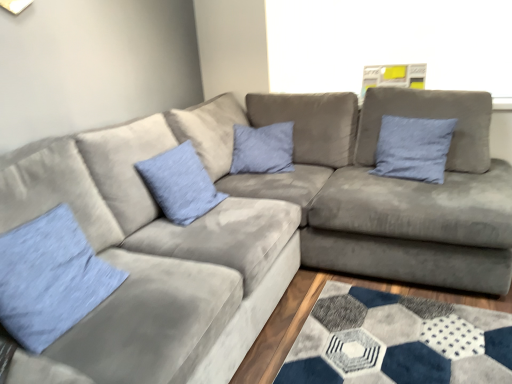
Measure the distance between point (186, 194) and camera.

A distance of 2.04 meters exists between point (186, 194) and camera.

At what (x,y) coordinates should I click in order to perform the action: click on light blue fabric pillow at lower left, the first pillow from the front. Please return your answer as a coordinate pair (x, y). This screenshot has height=384, width=512. Looking at the image, I should click on (50, 278).

This screenshot has width=512, height=384. In order to click on blue fabric pillow at center, which is counted as the 2th pillow, starting from the back in this screenshot , I will do `click(180, 184)`.

Is blue fabric pillow at upper right, which is counted as the 3th pillow, starting from the front, surrounding blue fabric pillow at center, the second pillow positioned from the front?

No, blue fabric pillow at upper right, which is counted as the 3th pillow, starting from the front, does not contain blue fabric pillow at center, the second pillow positioned from the front.

Which object is thinner, blue fabric pillow at upper right, which is counted as the 3th pillow, starting from the front, or blue fabric pillow at center, the second pillow positioned from the front?

blue fabric pillow at upper right, which is counted as the 3th pillow, starting from the front, is thinner.

Is blue fabric pillow at upper right, which is the third pillow in left-to-right order, behind blue fabric pillow at center, which is counted as the 2th pillow, starting from the back?

Yes, blue fabric pillow at upper right, which is the third pillow in left-to-right order, is behind blue fabric pillow at center, which is counted as the 2th pillow, starting from the back.

Looking at this image, is blue fabric pillow at center, which is counted as the 2th pillow, starting from the back, in front of blue fabric pillow at upper right, the first pillow in the right-to-left sequence?

Yes, the depth of blue fabric pillow at center, which is counted as the 2th pillow, starting from the back, is less than that of blue fabric pillow at upper right, the first pillow in the right-to-left sequence.

Considering the positions of point (168, 161) and point (440, 134), is point (168, 161) closer or farther from the camera than point (440, 134)?

Point (168, 161) appears to be closer to the viewer than point (440, 134).

From a real-world perspective, is blue fabric pillow at center, which appears as the second pillow when viewed from the right, over blue fabric pillow at upper right, which is the third pillow in left-to-right order?

Actually, blue fabric pillow at center, which appears as the second pillow when viewed from the right, is physically below blue fabric pillow at upper right, which is the third pillow in left-to-right order, in the real world.

Can we say light blue fabric pillow at lower left, which is counted as the third pillow, starting from the back, lies outside blue fabric pillow at center, the second pillow positioned from the front?

Yes, light blue fabric pillow at lower left, which is counted as the third pillow, starting from the back, is outside of blue fabric pillow at center, the second pillow positioned from the front.

From a real-world perspective, is light blue fabric pillow at lower left, the 1th pillow viewed from the left, below blue fabric pillow at center, acting as the second pillow starting from the left?

Yes, from a real-world perspective, light blue fabric pillow at lower left, the 1th pillow viewed from the left, is beneath blue fabric pillow at center, acting as the second pillow starting from the left.

Considering the relative sizes of light blue fabric pillow at lower left, the 1th pillow viewed from the left, and blue fabric pillow at center, acting as the second pillow starting from the left, in the image provided, is light blue fabric pillow at lower left, the 1th pillow viewed from the left, thinner than blue fabric pillow at center, acting as the second pillow starting from the left,?

Incorrect, the width of light blue fabric pillow at lower left, the 1th pillow viewed from the left, is not less than that of blue fabric pillow at center, acting as the second pillow starting from the left.

The image size is (512, 384). In order to click on pillow below the blue fabric pillow at center, which is counted as the 2th pillow, starting from the back (from a real-world perspective) in this screenshot , I will do `click(50, 278)`.

Is blue fabric pillow at center, the second pillow positioned from the front, further to the viewer compared to light blue fabric pillow at lower left, which is counted as the third pillow, starting from the back?

Yes.

Does blue fabric pillow at center, which is counted as the 2th pillow, starting from the back, turn towards light blue fabric pillow at lower left, which is counted as the third pillow, starting from the back?

No, blue fabric pillow at center, which is counted as the 2th pillow, starting from the back, is not aimed at light blue fabric pillow at lower left, which is counted as the third pillow, starting from the back.

Can you confirm if blue fabric pillow at center, which is counted as the 2th pillow, starting from the back, is taller than light blue fabric pillow at lower left, the first pillow from the front?

Correct, blue fabric pillow at center, which is counted as the 2th pillow, starting from the back, is much taller as light blue fabric pillow at lower left, the first pillow from the front.

Is blue fabric pillow at upper right, the first pillow in the right-to-left sequence, in front of or behind light blue fabric pillow at lower left, which is counted as the third pillow, starting from the back, in the image?

Clearly, blue fabric pillow at upper right, the first pillow in the right-to-left sequence, is behind light blue fabric pillow at lower left, which is counted as the third pillow, starting from the back.

Considering the relative positions of blue fabric pillow at upper right, which is the third pillow in left-to-right order, and light blue fabric pillow at lower left, which is counted as the third pillow, starting from the back, in the image provided, is blue fabric pillow at upper right, which is the third pillow in left-to-right order, to the right of light blue fabric pillow at lower left, which is counted as the third pillow, starting from the back, from the viewer's perspective?

Yes.

Can you see blue fabric pillow at upper right, which is the third pillow in left-to-right order, touching light blue fabric pillow at lower left, the first pillow from the front?

Result: No, blue fabric pillow at upper right, which is the third pillow in left-to-right order, is not with light blue fabric pillow at lower left, the first pillow from the front.

Between light blue fabric pillow at lower left, the first pillow from the front, and blue fabric pillow at upper right, the first pillow in the right-to-left sequence, which one has smaller width?

blue fabric pillow at upper right, the first pillow in the right-to-left sequence.

Is light blue fabric pillow at lower left, the first pillow from the front, directly adjacent to blue fabric pillow at upper right, the first pillow in the back-to-front sequence?

There is a gap between light blue fabric pillow at lower left, the first pillow from the front, and blue fabric pillow at upper right, the first pillow in the back-to-front sequence.

From the image's perspective, is light blue fabric pillow at lower left, which is counted as the 3th pillow, starting from the right, over blue fabric pillow at upper right, the first pillow in the back-to-front sequence?

Actually, light blue fabric pillow at lower left, which is counted as the 3th pillow, starting from the right, appears below blue fabric pillow at upper right, the first pillow in the back-to-front sequence, in the image.

What are the coordinates of `pillow that is behind the blue fabric pillow at center, the second pillow positioned from the front` in the screenshot? It's located at (413, 148).

This screenshot has width=512, height=384. Identify the location of pillow on the right of the blue fabric pillow at center, which is counted as the 2th pillow, starting from the back. (413, 148).

Looking at the image, which one is located closer to blue fabric pillow at center, acting as the second pillow starting from the left, blue fabric pillow at upper right, which is the third pillow in left-to-right order, or light blue fabric pillow at lower left, the first pillow from the front?

Among the two, light blue fabric pillow at lower left, the first pillow from the front, is located nearer to blue fabric pillow at center, acting as the second pillow starting from the left.

Consider the image. Based on their spatial positions, is light blue fabric pillow at lower left, the first pillow from the front, or blue fabric pillow at center, which appears as the second pillow when viewed from the right, further from blue fabric pillow at upper right, which is counted as the 3th pillow, starting from the front?

light blue fabric pillow at lower left, the first pillow from the front, is positioned further to the anchor blue fabric pillow at upper right, which is counted as the 3th pillow, starting from the front.

Which object lies further to the anchor point light blue fabric pillow at lower left, the 1th pillow viewed from the left, blue fabric pillow at center, which is counted as the 2th pillow, starting from the back, or blue fabric pillow at upper right, which is counted as the 3th pillow, starting from the front?

blue fabric pillow at upper right, which is counted as the 3th pillow, starting from the front, lies further to light blue fabric pillow at lower left, the 1th pillow viewed from the left, than the other object.

Looking at the image, which one is located further to blue fabric pillow at center, the second pillow positioned from the front, light blue fabric pillow at lower left, the 1th pillow viewed from the left, or blue fabric pillow at upper right, the first pillow in the right-to-left sequence?

Among the two, blue fabric pillow at upper right, the first pillow in the right-to-left sequence, is located further to blue fabric pillow at center, the second pillow positioned from the front.

From the image, which object appears to be nearer to blue fabric pillow at upper right, the first pillow in the back-to-front sequence, blue fabric pillow at center, which is counted as the 2th pillow, starting from the back, or light blue fabric pillow at lower left, which is counted as the 3th pillow, starting from the right?

blue fabric pillow at center, which is counted as the 2th pillow, starting from the back, is closer to blue fabric pillow at upper right, the first pillow in the back-to-front sequence.

Considering their positions, is blue fabric pillow at upper right, which is the third pillow in left-to-right order, positioned closer to light blue fabric pillow at lower left, the 1th pillow viewed from the left, than blue fabric pillow at center, which appears as the second pillow when viewed from the right?

The object closer to light blue fabric pillow at lower left, the 1th pillow viewed from the left, is blue fabric pillow at center, which appears as the second pillow when viewed from the right.

You are a GUI agent. You are given a task and a screenshot of the screen. Output one action in this format:
    pyautogui.click(x=<x>, y=<y>)
    Task: Click on the pillow situated between light blue fabric pillow at lower left, which is counted as the third pillow, starting from the back, and blue fabric pillow at upper right, the first pillow in the back-to-front sequence, from left to right
    The height and width of the screenshot is (384, 512).
    Given the screenshot: What is the action you would take?
    pyautogui.click(x=180, y=184)